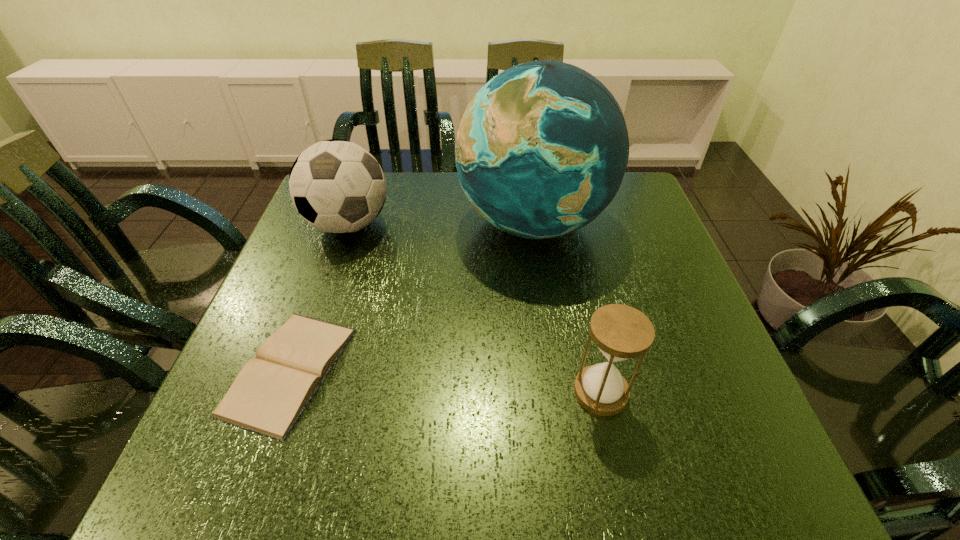
Where is `object that is at the near edge`? This screenshot has width=960, height=540. object that is at the near edge is located at coordinates (271, 391).

The width and height of the screenshot is (960, 540). I want to click on soccer ball present at the left edge, so click(337, 186).

Locate an element on the screen. This screenshot has width=960, height=540. Bible positioned at the left edge is located at coordinates (271, 391).

Where is `object that is at the right edge`? This screenshot has height=540, width=960. object that is at the right edge is located at coordinates (542, 148).

This screenshot has height=540, width=960. Identify the location of object positioned at the far left corner. (337, 186).

Locate an element on the screen. This screenshot has width=960, height=540. object positioned at the near left corner is located at coordinates (271, 391).

Locate an element on the screen. This screenshot has width=960, height=540. object located at the far right corner is located at coordinates [x=542, y=148].

Locate an element on the screen. This screenshot has width=960, height=540. free space at the far edge of the desktop is located at coordinates (433, 186).

The image size is (960, 540). Find the location of `vacant space at the right edge`. vacant space at the right edge is located at coordinates (661, 403).

I want to click on free space at the far right corner, so click(638, 209).